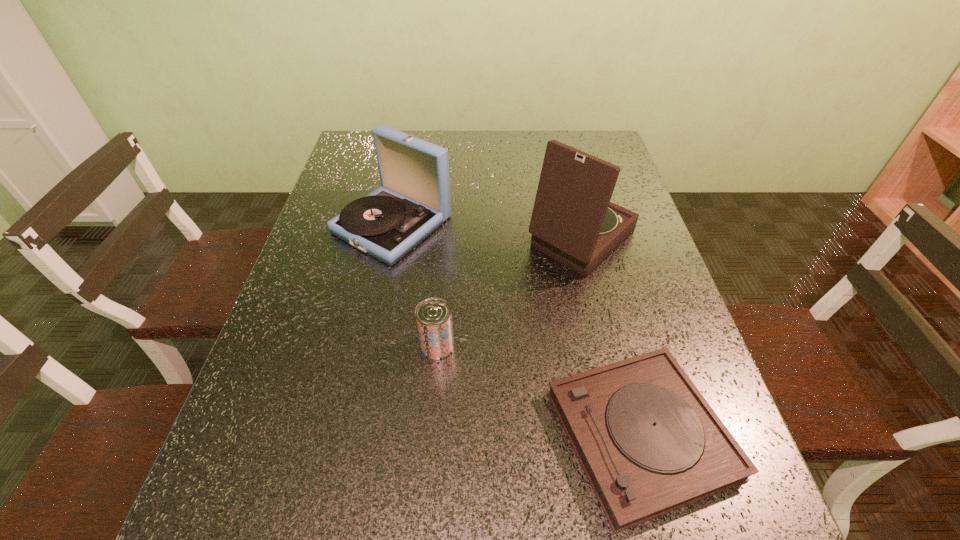
Locate an element on the screen. object that is at the near edge is located at coordinates (649, 443).

The image size is (960, 540). Identify the location of object that is at the left edge. (414, 200).

Find the location of a particular element. The height and width of the screenshot is (540, 960). object that is at the near right corner is located at coordinates click(x=649, y=443).

Identify the location of free spot at the far edge of the desktop. (516, 144).

Where is `free space at the near edge of the desktop`? free space at the near edge of the desktop is located at coordinates (577, 530).

At what (x,y) coordinates should I click in order to perform the action: click on vacant space at the left edge of the desktop. Please return your answer as a coordinate pair (x, y). This screenshot has height=540, width=960. Looking at the image, I should click on coord(318,389).

In the image, there is a desktop. At what (x,y) coordinates should I click in order to perform the action: click on vacant space at the right edge. Please return your answer as a coordinate pair (x, y). Image resolution: width=960 pixels, height=540 pixels. Looking at the image, I should click on (630, 205).

Image resolution: width=960 pixels, height=540 pixels. I want to click on vacant space at the far right corner of the desktop, so click(x=605, y=143).

The height and width of the screenshot is (540, 960). I want to click on free space between the nearest phonograph record and the leftmost phonograph record, so click(516, 329).

Identify the location of vacant area that lies between the shortest phonograph record and the third tallest object. (539, 390).